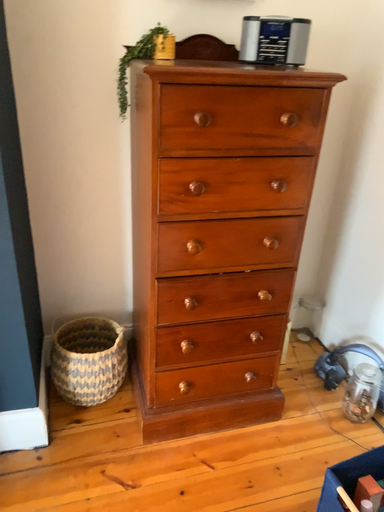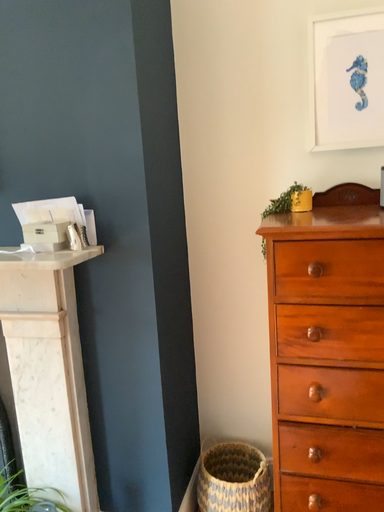
Question: Which way did the camera rotate in the video?

Choices:
 (A) rotated right
 (B) rotated left

Answer: (B)